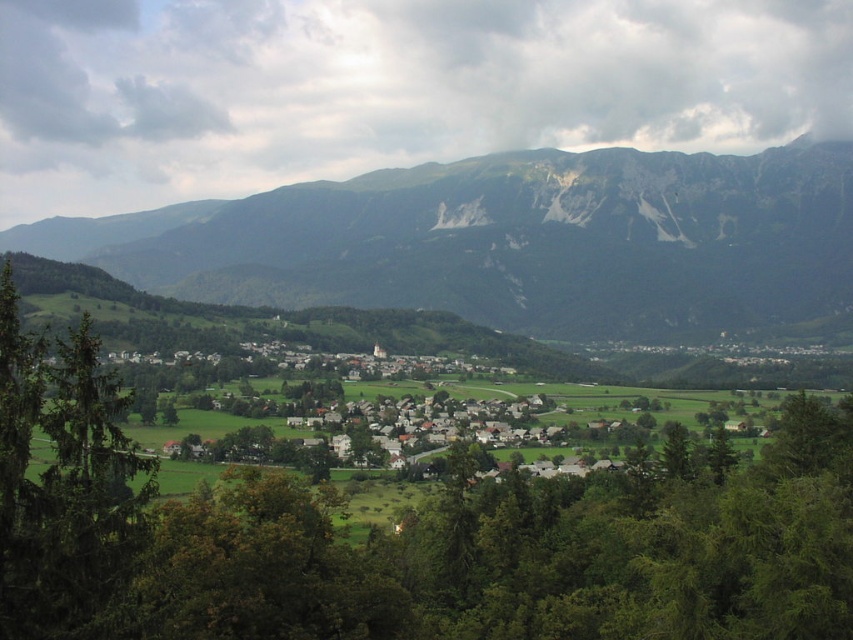
Question: Which object is the farthest from the green leafy tree at left?

Choices:
 (A) green leafy tree at center
 (B) green rocky mountain at upper center

Answer: (B)

Question: Can you confirm if green leafy tree at center is positioned to the left of green leafy tree at left?

Choices:
 (A) yes
 (B) no

Answer: (B)

Question: Is green leafy tree at center thinner than green leafy tree at left?

Choices:
 (A) yes
 (B) no

Answer: (B)

Question: Which of the following is the closest to the observer?

Choices:
 (A) (137, 465)
 (B) (610, 624)
 (C) (543, 236)

Answer: (A)

Question: Does green leafy tree at center appear over green rocky mountain at upper center?

Choices:
 (A) yes
 (B) no

Answer: (B)

Question: Which object is positioned farthest from the green rocky mountain at upper center?

Choices:
 (A) green leafy tree at left
 (B) green leafy tree at center

Answer: (A)